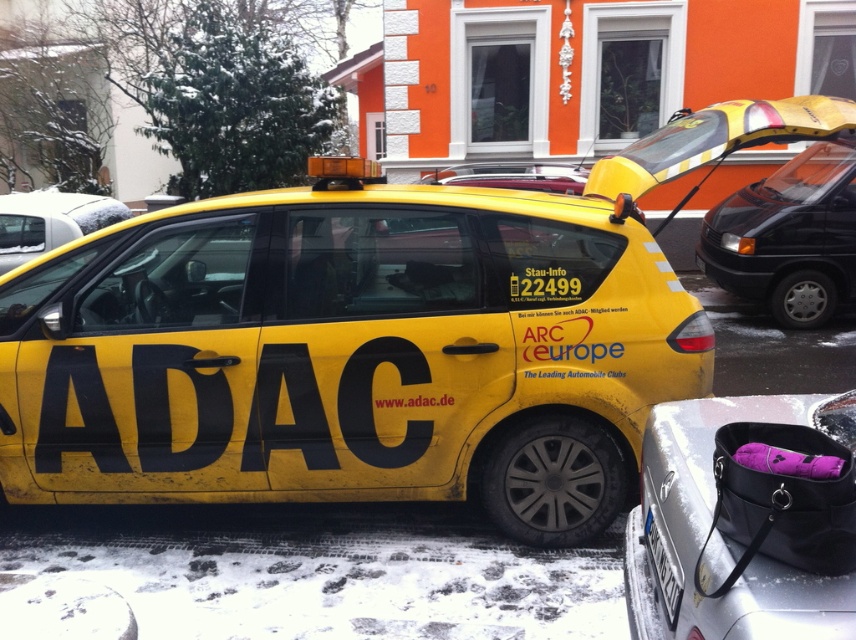
Question: Among these objects, which one is farthest from the camera?

Choices:
 (A) yellow matte car at center
 (B) black leather handbag at lower right
 (C) yellow matte taxi at center

Answer: (A)

Question: Can you confirm if black matte van at upper right is smaller than white plastic license plate at lower center?

Choices:
 (A) no
 (B) yes

Answer: (A)

Question: From the image, what is the correct spatial relationship of black leather handbag at lower right in relation to white plastic license plate at lower center?

Choices:
 (A) below
 (B) above

Answer: (B)

Question: Which object appears closest to the camera in this image?

Choices:
 (A) black leather handbag at lower right
 (B) black matte van at upper right

Answer: (A)

Question: Does yellow matte taxi at center have a larger size compared to black leather handbag at lower right?

Choices:
 (A) no
 (B) yes

Answer: (B)

Question: Considering the real-world distances, which object is closest to the black leather handbag at lower right?

Choices:
 (A) black matte van at upper right
 (B) yellow matte taxi at center
 (C) yellow matte car at center
 (D) white plastic license plate at lower center

Answer: (D)